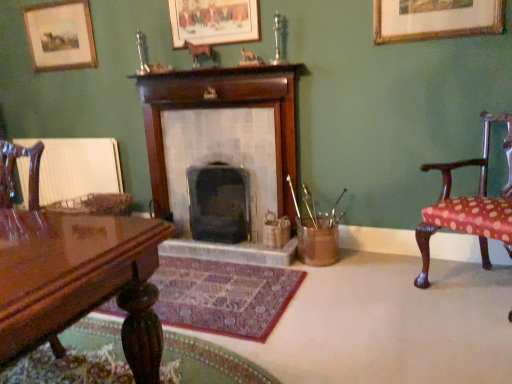
Where is `gold-framed picture at upper right, which ranks as the 3th picture frame in back-to-front order`? The width and height of the screenshot is (512, 384). gold-framed picture at upper right, which ranks as the 3th picture frame in back-to-front order is located at coordinates (435, 19).

What do you see at coordinates (219, 203) in the screenshot?
I see `smooth gray stone fireplace at center, the 1th fireplace in the right-to-left sequence` at bounding box center [219, 203].

The image size is (512, 384). Describe the element at coordinates (223, 144) in the screenshot. I see `wooden fireplace at center, the 2th fireplace in the right-to-left sequence` at that location.

Locate an element on the screen. The image size is (512, 384). wooden picture frame at upper center, positioned as the second picture frame in right-to-left order is located at coordinates (214, 22).

What is the approximate height of shiny brown wood chair at left, which is the second chair from right to left?

It is 38.58 inches.

Locate an element on the screen. The width and height of the screenshot is (512, 384). gold-framed picture at upper right, acting as the third picture frame starting from the left is located at coordinates (435, 19).

In the image, is smooth gray stone fireplace at center, the 1th fireplace in the right-to-left sequence, positioned in front of or behind matte wooden picture frame at upper left, the third picture frame when ordered from front to back?

In the image, smooth gray stone fireplace at center, the 1th fireplace in the right-to-left sequence, appears in front of matte wooden picture frame at upper left, the third picture frame when ordered from front to back.

Is smooth gray stone fireplace at center, the 1th fireplace in the right-to-left sequence, positioned beyond the bounds of matte wooden picture frame at upper left, the third picture frame when ordered from front to back?

Indeed, smooth gray stone fireplace at center, the 1th fireplace in the right-to-left sequence, is completely outside matte wooden picture frame at upper left, the third picture frame when ordered from front to back.

Which object is thinner, smooth gray stone fireplace at center, the 1th fireplace in the right-to-left sequence, or matte wooden picture frame at upper left, the third picture frame when ordered from front to back?

matte wooden picture frame at upper left, the third picture frame when ordered from front to back, is thinner.

From a real-world perspective, who is located higher, smooth gray stone fireplace at center, the 1th fireplace in the right-to-left sequence, or matte wooden picture frame at upper left, the 1th picture frame from the back?

matte wooden picture frame at upper left, the 1th picture frame from the back.

Is gold-framed picture at upper right, arranged as the first picture frame when viewed from the front, facing away from smooth gray stone fireplace at center, the second fireplace from the left?

No, gold-framed picture at upper right, arranged as the first picture frame when viewed from the front,'s orientation is not away from smooth gray stone fireplace at center, the second fireplace from the left.

Can smooth gray stone fireplace at center, the second fireplace from the left, be found inside gold-framed picture at upper right, acting as the third picture frame starting from the left?

No.

Is gold-framed picture at upper right, acting as the third picture frame starting from the left, not near smooth gray stone fireplace at center, the second fireplace from the left?

Yes, gold-framed picture at upper right, acting as the third picture frame starting from the left, and smooth gray stone fireplace at center, the second fireplace from the left, are located far from each other.

Is polka dot fabric chair at right, which is the second chair in left-to-right order, positioned far away from matte wooden picture frame at upper left, the 1th picture frame from the back?

Absolutely, polka dot fabric chair at right, which is the second chair in left-to-right order, is distant from matte wooden picture frame at upper left, the 1th picture frame from the back.

Who is shorter, polka dot fabric chair at right, the first chair viewed from the right, or matte wooden picture frame at upper left, the third picture frame when ordered from front to back?

With less height is matte wooden picture frame at upper left, the third picture frame when ordered from front to back.

Based on the photo, could matte wooden picture frame at upper left, the 1th picture frame from the back, be considered to be inside polka dot fabric chair at right, the first chair viewed from the right?

No, matte wooden picture frame at upper left, the 1th picture frame from the back, is not a part of polka dot fabric chair at right, the first chair viewed from the right.

Locate an element on the screen. This screenshot has height=384, width=512. picture frame on the right of wooden picture frame at upper center, arranged as the 2th picture frame when viewed from the back is located at coordinates (435, 19).

How much distance is there between gold-framed picture at upper right, the first picture frame in the right-to-left sequence, and wooden picture frame at upper center, arranged as the 2th picture frame when viewed from the back?

gold-framed picture at upper right, the first picture frame in the right-to-left sequence, is 3.77 feet away from wooden picture frame at upper center, arranged as the 2th picture frame when viewed from the back.

From the image's perspective, is gold-framed picture at upper right, which ranks as the 3th picture frame in back-to-front order, above or below wooden picture frame at upper center, positioned as the second picture frame in right-to-left order?

gold-framed picture at upper right, which ranks as the 3th picture frame in back-to-front order, is situated lower than wooden picture frame at upper center, positioned as the second picture frame in right-to-left order, in the image.

Can you see gold-framed picture at upper right, acting as the third picture frame starting from the left, touching wooden picture frame at upper center, the 2th picture frame when ordered from front to back?

No, gold-framed picture at upper right, acting as the third picture frame starting from the left, is not next to wooden picture frame at upper center, the 2th picture frame when ordered from front to back.

Is polka dot fabric chair at right, the first chair viewed from the right, in front of wooden fireplace at center, marked as the 1th fireplace in a left-to-right arrangement?

Yes, it is.

Who is taller, polka dot fabric chair at right, the first chair viewed from the right, or wooden fireplace at center, the 2th fireplace in the right-to-left sequence?

wooden fireplace at center, the 2th fireplace in the right-to-left sequence.

From the image's perspective, is polka dot fabric chair at right, which is the second chair in left-to-right order, located above or below wooden fireplace at center, marked as the 1th fireplace in a left-to-right arrangement?

From the image's perspective, polka dot fabric chair at right, which is the second chair in left-to-right order, appears below wooden fireplace at center, marked as the 1th fireplace in a left-to-right arrangement.

Identify the location of the 2nd fireplace to the left of the polka dot fabric chair at right, the first chair viewed from the right, counting from the anchor's position. (223, 144).

Between gold-framed picture at upper right, arranged as the first picture frame when viewed from the front, and polka dot fabric chair at right, the first chair viewed from the right, which one has more height?

polka dot fabric chair at right, the first chair viewed from the right.

Which point is more forward, (415, 30) or (448, 166)?

The point (415, 30) is closer to the camera.

Between gold-framed picture at upper right, arranged as the first picture frame when viewed from the front, and polka dot fabric chair at right, which is the second chair in left-to-right order, which one has smaller size?

With smaller size is gold-framed picture at upper right, arranged as the first picture frame when viewed from the front.

Is matte wooden picture frame at upper left, which appears as the third picture frame when viewed from the right, with shiny brown wood chair at left, which is the second chair from right to left?

No, matte wooden picture frame at upper left, which appears as the third picture frame when viewed from the right, is not with shiny brown wood chair at left, which is the second chair from right to left.

Between matte wooden picture frame at upper left, which appears as the third picture frame when viewed from the right, and shiny brown wood chair at left, marked as the 1th chair in a left-to-right arrangement, which one has smaller size?

matte wooden picture frame at upper left, which appears as the third picture frame when viewed from the right.

Is matte wooden picture frame at upper left, which is counted as the first picture frame, starting from the left, to the left or to the right of shiny brown wood chair at left, marked as the 1th chair in a left-to-right arrangement, in the image?

Based on their positions, matte wooden picture frame at upper left, which is counted as the first picture frame, starting from the left, is located to the left of shiny brown wood chair at left, marked as the 1th chair in a left-to-right arrangement.

Looking at this image, considering their positions, is matte wooden picture frame at upper left, the third picture frame when ordered from front to back, located in front of or behind shiny brown wood chair at left, marked as the 1th chair in a left-to-right arrangement?

matte wooden picture frame at upper left, the third picture frame when ordered from front to back, is behind shiny brown wood chair at left, marked as the 1th chair in a left-to-right arrangement.

You are a GUI agent. You are given a task and a screenshot of the screen. Output one action in this format:
    pyautogui.click(x=<x>, y=<y>)
    Task: Click on the picture frame behind the smooth gray stone fireplace at center, the 1th fireplace in the right-to-left sequence
    The height and width of the screenshot is (384, 512).
    Given the screenshot: What is the action you would take?
    pyautogui.click(x=60, y=35)

From a real-world perspective, starting from the gold-framed picture at upper right, arranged as the first picture frame when viewed from the front, which fireplace is the 2nd one below it? Please provide its 2D coordinates.

[(219, 203)]

Considering their positions, is wooden fireplace at center, the 2th fireplace in the right-to-left sequence, positioned closer to smooth gray stone fireplace at center, the second fireplace from the left, than shiny brown wood chair at left, marked as the 1th chair in a left-to-right arrangement?

wooden fireplace at center, the 2th fireplace in the right-to-left sequence, lies closer to smooth gray stone fireplace at center, the second fireplace from the left, than the other object.

From the image, which object appears to be farther from polka dot fabric chair at right, which is the second chair in left-to-right order, wooden picture frame at upper center, positioned as the second picture frame in right-to-left order, or matte wooden picture frame at upper left, the third picture frame when ordered from front to back?

matte wooden picture frame at upper left, the third picture frame when ordered from front to back, is further to polka dot fabric chair at right, which is the second chair in left-to-right order.

Which object lies nearer to the anchor point wooden picture frame at upper center, arranged as the 2th picture frame when viewed from the back, matte wooden picture frame at upper left, the third picture frame when ordered from front to back, or gold-framed picture at upper right, acting as the third picture frame starting from the left?

Among the two, matte wooden picture frame at upper left, the third picture frame when ordered from front to back, is located nearer to wooden picture frame at upper center, arranged as the 2th picture frame when viewed from the back.

Based on their spatial positions, is shiny brown wood chair at left, which is the second chair from right to left, or polka dot fabric chair at right, the first chair viewed from the right, closer to gold-framed picture at upper right, which ranks as the 3th picture frame in back-to-front order?

Among the two, polka dot fabric chair at right, the first chair viewed from the right, is located nearer to gold-framed picture at upper right, which ranks as the 3th picture frame in back-to-front order.

When comparing their distances from wooden picture frame at upper center, positioned as the second picture frame in right-to-left order, does gold-framed picture at upper right, arranged as the first picture frame when viewed from the front, or shiny brown wood chair at left, marked as the 1th chair in a left-to-right arrangement, seem further?

shiny brown wood chair at left, marked as the 1th chair in a left-to-right arrangement.

Considering their positions, is polka dot fabric chair at right, which is the second chair in left-to-right order, positioned closer to wooden picture frame at upper center, positioned as the second picture frame in right-to-left order, than shiny brown wood chair at left, which is the second chair from right to left?

Among the two, polka dot fabric chair at right, which is the second chair in left-to-right order, is located nearer to wooden picture frame at upper center, positioned as the second picture frame in right-to-left order.

From the image, which object appears to be farther from wooden fireplace at center, the 2th fireplace in the right-to-left sequence, gold-framed picture at upper right, acting as the third picture frame starting from the left, or smooth gray stone fireplace at center, the second fireplace from the left?

gold-framed picture at upper right, acting as the third picture frame starting from the left, is further to wooden fireplace at center, the 2th fireplace in the right-to-left sequence.

Which object lies further to the anchor point wooden picture frame at upper center, which is the 2th picture frame from left to right, shiny brown wood chair at left, marked as the 1th chair in a left-to-right arrangement, or matte wooden picture frame at upper left, the third picture frame when ordered from front to back?

shiny brown wood chair at left, marked as the 1th chair in a left-to-right arrangement.

Find the location of a particular element. fireplace between shiny brown wood chair at left, marked as the 1th chair in a left-to-right arrangement, and smooth gray stone fireplace at center, the second fireplace from the left, from front to back is located at coordinates (223, 144).

What are the coordinates of `picture frame between matte wooden picture frame at upper left, which appears as the third picture frame when viewed from the right, and smooth gray stone fireplace at center, the 1th fireplace in the right-to-left sequence` in the screenshot? It's located at (214, 22).

Locate an element on the screen. This screenshot has width=512, height=384. fireplace between wooden picture frame at upper center, which is the 2th picture frame from left to right, and smooth gray stone fireplace at center, the second fireplace from the left, vertically is located at coordinates (223, 144).

Locate an element on the screen. picture frame between smooth gray stone fireplace at center, the 1th fireplace in the right-to-left sequence, and polka dot fabric chair at right, the first chair viewed from the right is located at coordinates (435, 19).